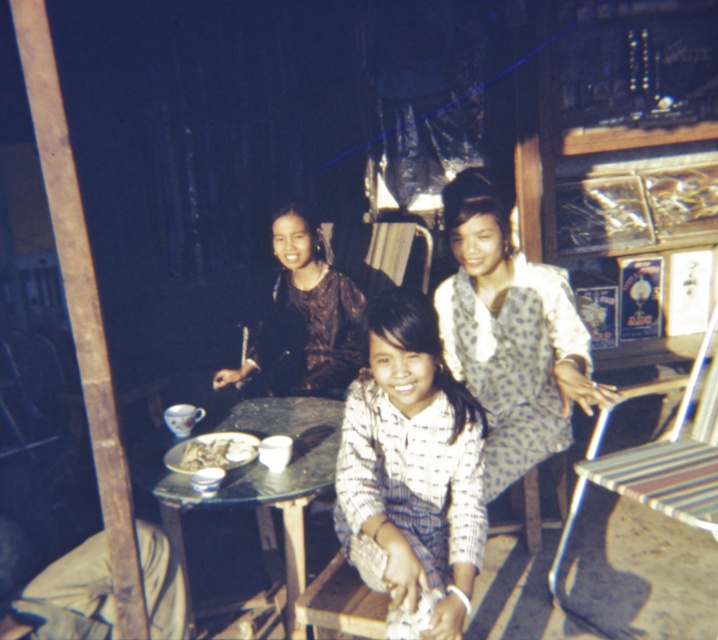
You are a photographer trying to capture a candid shot of the scene. You want to ensure that both the polka dot blouse at center and the white glossy plate at center are clearly visible in the frame. Based on their positions, which object is closer to the right edge of the photo?

The polka dot blouse at center is positioned on the right side of the white glossy plate at center, so it is closer to the right edge of the photo.

Based on the scene description, where is the metallic striped chair at right located in terms of its 2D coordinates?

The metallic striped chair at right is located at the 2D coordinates of point (658, 465).

You are a photographer trying to capture a candid shot of the polka dot blouse at center and the white glossy plate at center. Since you want to focus on both objects, which one should you adjust your camera focus on first to ensure both are in frame?

The polka dot blouse at center is located above the white glossy plate at center, so adjusting focus on the polka dot blouse at center first will ensure both are in frame as the plate is below it.